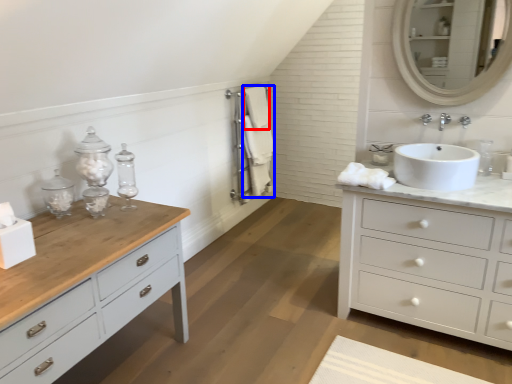
Question: Among these objects, which one is farthest to the camera, bath towel (highlighted by a red box) or bath towel (highlighted by a blue box)?

Choices:
 (A) bath towel
 (B) bath towel

Answer: (A)